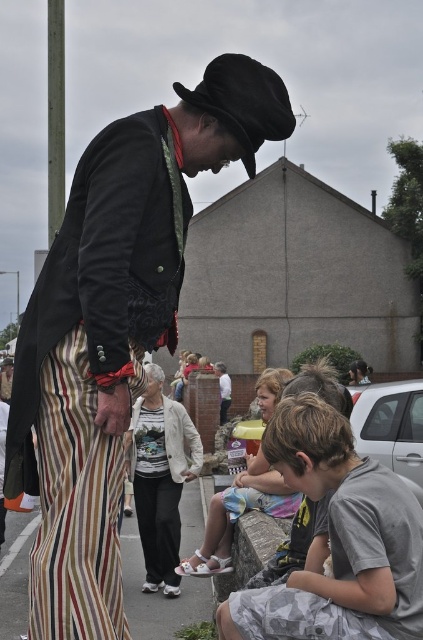
Which of these two, gray cotton t-shirt at lower right or black felt fedora at upper center, stands taller?

gray cotton t-shirt at lower right is taller.

Between gray cotton t-shirt at lower right and black felt fedora at upper center, which one appears on the right side from the viewer's perspective?

gray cotton t-shirt at lower right

Where is `gray cotton t-shirt at lower right`? This screenshot has height=640, width=423. gray cotton t-shirt at lower right is located at coordinates (337, 540).

Find the location of a particular element. The width and height of the screenshot is (423, 640). gray cotton t-shirt at lower right is located at coordinates pyautogui.click(x=337, y=540).

Does gray cotton t-shirt at lower right appear over light brown wooden bench at lower center?

Correct, gray cotton t-shirt at lower right is located above light brown wooden bench at lower center.

Between point (307, 444) and point (263, 404), which one is positioned in front?

Point (307, 444) is more forward.

Who is more forward, (x=324, y=476) or (x=280, y=380)?

Point (x=324, y=476) is more forward.

Where is `gray cotton t-shirt at lower right`? This screenshot has height=640, width=423. gray cotton t-shirt at lower right is located at coordinates (337, 540).

Can you confirm if black felt fedora at upper center is positioned below light brown wooden bench at lower center?

Incorrect, black felt fedora at upper center is not positioned below light brown wooden bench at lower center.

Describe the element at coordinates (244, 100) in the screenshot. I see `black felt fedora at upper center` at that location.

Identify the location of black felt fedora at upper center. Image resolution: width=423 pixels, height=640 pixels. (244, 100).